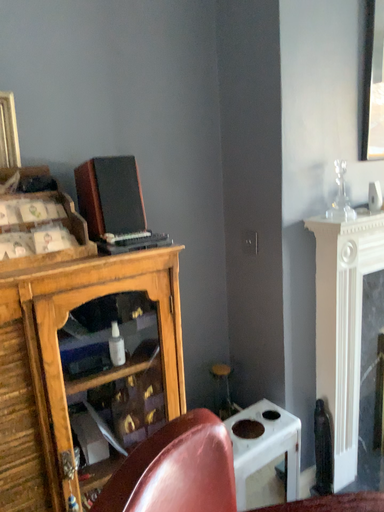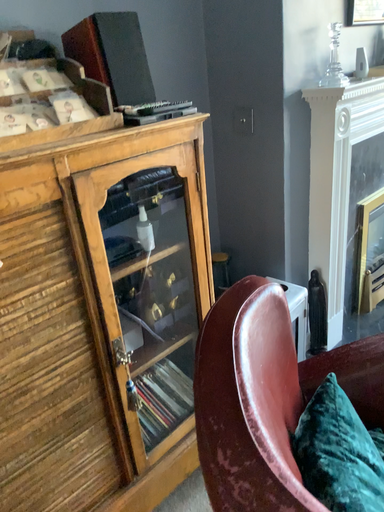
Question: How did the camera likely rotate when shooting the video?

Choices:
 (A) rotated right
 (B) rotated left

Answer: (A)